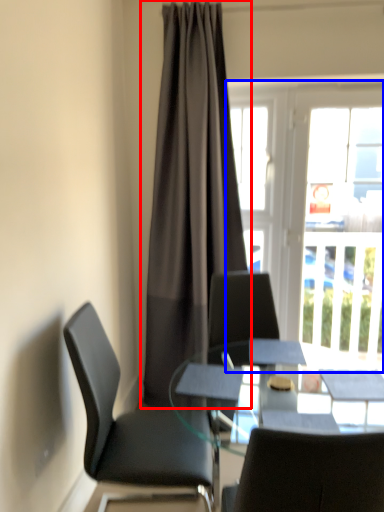
Question: Among these objects, which one is nearest to the camera, curtain (highlighted by a red box) or window (highlighted by a blue box)?

Choices:
 (A) curtain
 (B) window

Answer: (A)